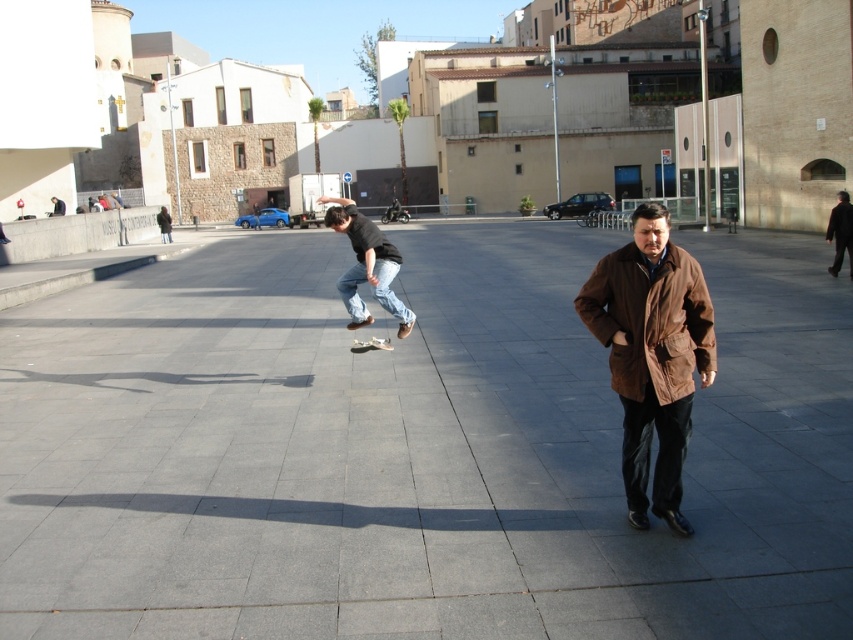
From the picture: You are standing in the plaza and want to walk from the point at coordinates point (671, 355) to the point at coordinates point (367, 346). Which direction should you move relative to your current position?

Since point (671, 355) is closer to the viewer than point (367, 346), you should move away from your current position towards the background to reach point (367, 346).